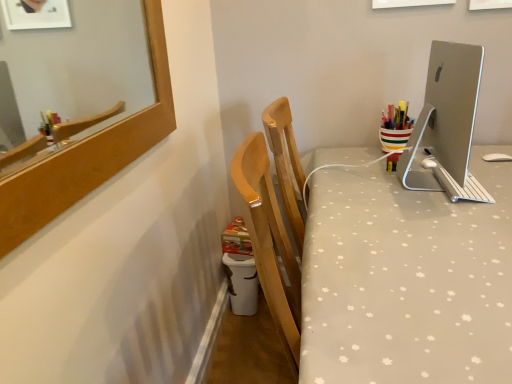
Image resolution: width=512 pixels, height=384 pixels. Find the location of `free space to the right of silver metallic monitor at upper right`. free space to the right of silver metallic monitor at upper right is located at coordinates (490, 172).